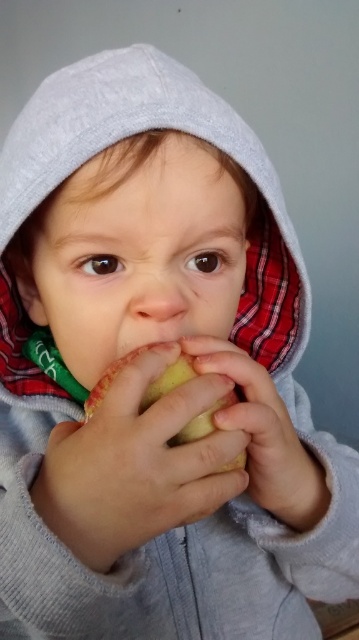
Question: Which of the following is the farthest from the observer?

Choices:
 (A) gray cotton hoodie at center
 (B) yellow matte apple at center

Answer: (A)

Question: Can you confirm if gray cotton hoodie at center is smaller than yellow matte apple at center?

Choices:
 (A) no
 (B) yes

Answer: (A)

Question: Does gray cotton hoodie at center have a lesser width compared to yellow matte apple at center?

Choices:
 (A) no
 (B) yes

Answer: (A)

Question: Which point is closer to the camera taking this photo?

Choices:
 (A) (109, 68)
 (B) (91, 406)

Answer: (B)

Question: Which point appears farthest from the camera in this image?

Choices:
 (A) [276, 189]
 (B) [105, 388]

Answer: (A)

Question: Does gray cotton hoodie at center appear over yellow matte apple at center?

Choices:
 (A) yes
 (B) no

Answer: (A)